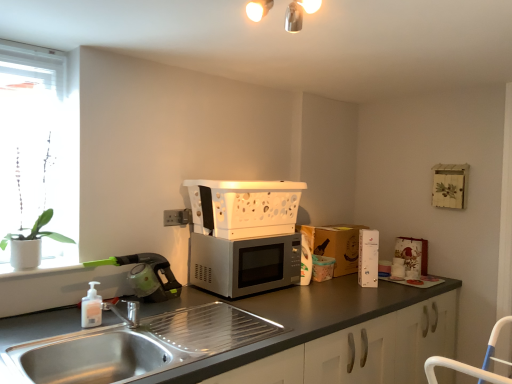
Question: Which direction should I rotate to look at white plastic microwave at center, positioned as the 2th appliance in left-to-right order, — up or down?

Choices:
 (A) down
 (B) up

Answer: (A)

Question: Is green plastic vacuum cleaner at left, which is the 3th appliance in right-to-left order, at the right side of matte gray countertop at center?

Choices:
 (A) yes
 (B) no

Answer: (B)

Question: Is green plastic vacuum cleaner at left, which is the 3th appliance in right-to-left order, shorter than matte gray countertop at center?

Choices:
 (A) no
 (B) yes

Answer: (B)

Question: From the image's perspective, does green plastic vacuum cleaner at left, which is the 3th appliance in right-to-left order, appear lower than matte gray countertop at center?

Choices:
 (A) no
 (B) yes

Answer: (A)

Question: Does green plastic vacuum cleaner at left, the first appliance positioned from the left, have a smaller size compared to matte gray countertop at center?

Choices:
 (A) no
 (B) yes

Answer: (B)

Question: Are green plastic vacuum cleaner at left, which is the 3th appliance in right-to-left order, and matte gray countertop at center located far from each other?

Choices:
 (A) yes
 (B) no

Answer: (B)

Question: Considering the relative sizes of green plastic vacuum cleaner at left, which is the 3th appliance in right-to-left order, and matte gray countertop at center in the image provided, is green plastic vacuum cleaner at left, which is the 3th appliance in right-to-left order, taller than matte gray countertop at center?

Choices:
 (A) yes
 (B) no

Answer: (B)

Question: Is white cardboard box at right, which ranks as the 3th appliance in left-to-right order, facing towards stainless steel sink at lower left?

Choices:
 (A) no
 (B) yes

Answer: (A)

Question: Is stainless steel sink at lower left located within white cardboard box at right, the first appliance positioned from the right?

Choices:
 (A) yes
 (B) no

Answer: (B)

Question: Is white cardboard box at right, which ranks as the 3th appliance in left-to-right order, not near stainless steel sink at lower left?

Choices:
 (A) no
 (B) yes

Answer: (B)

Question: Does white cardboard box at right, which ranks as the 3th appliance in left-to-right order, touch stainless steel sink at lower left?

Choices:
 (A) yes
 (B) no

Answer: (B)

Question: From the image's perspective, is white cardboard box at right, which ranks as the 3th appliance in left-to-right order, on stainless steel sink at lower left?

Choices:
 (A) no
 (B) yes

Answer: (B)

Question: Does white cardboard box at right, which ranks as the 3th appliance in left-to-right order, have a smaller size compared to stainless steel sink at lower left?

Choices:
 (A) yes
 (B) no

Answer: (A)

Question: Does white matte soap dispenser at sink left have a greater height compared to satin silver microwave at center?

Choices:
 (A) yes
 (B) no

Answer: (B)